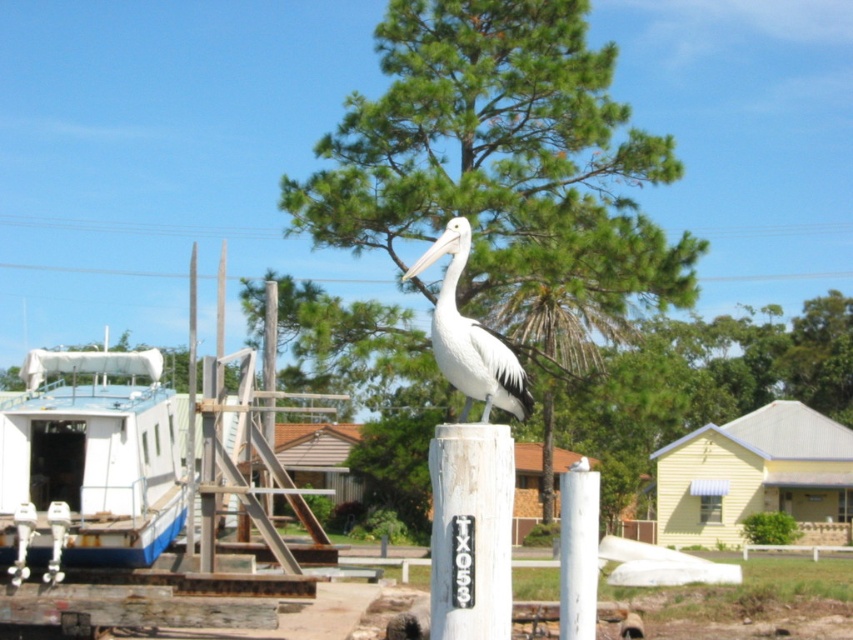
What is located at the coordinates point (500, 163)?

The green leafy tree at center is located at point (500, 163).

You are standing in front of the scene and want to take a photo. There are two points marked in the image, point [444,227] and point [575,493]. Which point is closer to you?

Point [444,227] is further to the camera than point [575,493], so the point closer to you is point [575,493].

You are a birdwatcher observing the scene. You notice the white matte pelican at center and the white painted wood post at center. Which object is located to the right of the other?

The white painted wood post at center is located to the right of the white matte pelican at center because the pelican is on the left side of the post.